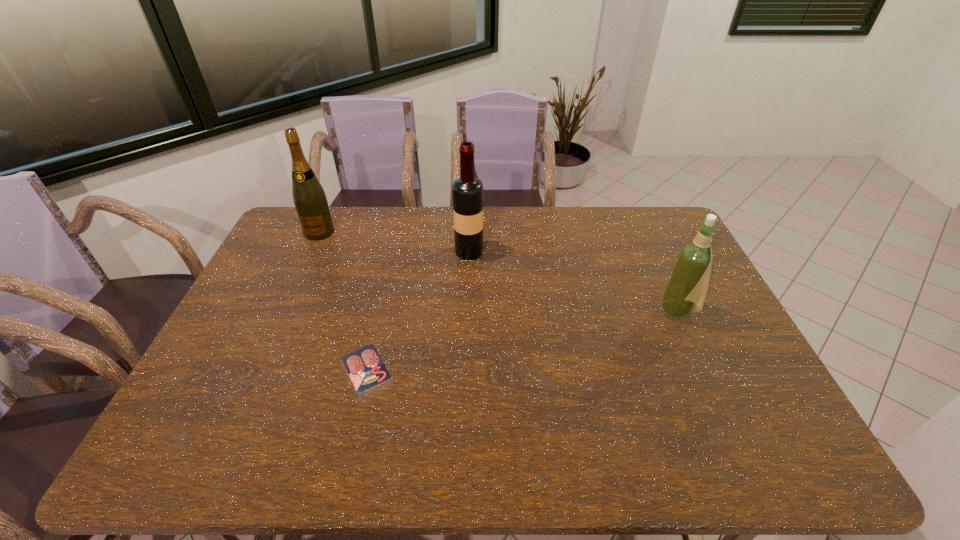
Where is `free space between the nearest wine bottle and the second nearest wine bottle`? The image size is (960, 540). free space between the nearest wine bottle and the second nearest wine bottle is located at coordinates (573, 281).

The width and height of the screenshot is (960, 540). I want to click on the third closest object to the nearest object, so click(x=688, y=284).

Where is `object that stands as the second closest to the second farthest object`? The width and height of the screenshot is (960, 540). object that stands as the second closest to the second farthest object is located at coordinates (310, 201).

Choose which wine bottle is the second nearest neighbor to the shortest object. Please provide its 2D coordinates. Your answer should be formatted as a tuple, i.e. [(x, y)], where the tuple contains the x and y coordinates of a point satisfying the conditions above.

[(310, 201)]

Select which wine bottle appears as the closest to the second wine bottle from left to right. Please provide its 2D coordinates. Your answer should be formatted as a tuple, i.e. [(x, y)], where the tuple contains the x and y coordinates of a point satisfying the conditions above.

[(310, 201)]

Where is `free spot that satisfies the following two spatial constraints: 1. on the front-facing side of the leftmost object; 2. on the right side of the third object from right to left`? Image resolution: width=960 pixels, height=540 pixels. free spot that satisfies the following two spatial constraints: 1. on the front-facing side of the leftmost object; 2. on the right side of the third object from right to left is located at coordinates (258, 368).